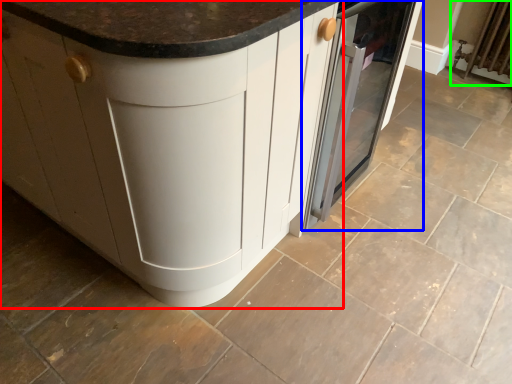
Question: Which object is positioned farthest from cabinetry (highlighted by a red box)? Select from home appliance (highlighted by a blue box) and radiator (highlighted by a green box).

Choices:
 (A) home appliance
 (B) radiator

Answer: (B)